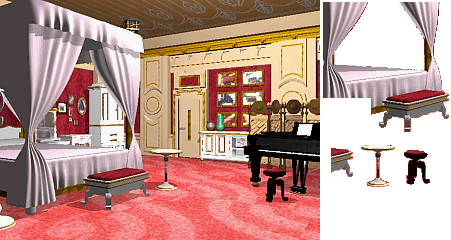
Locate an element on the screen. Image resolution: width=451 pixels, height=240 pixels. closet is located at coordinates (112, 114).